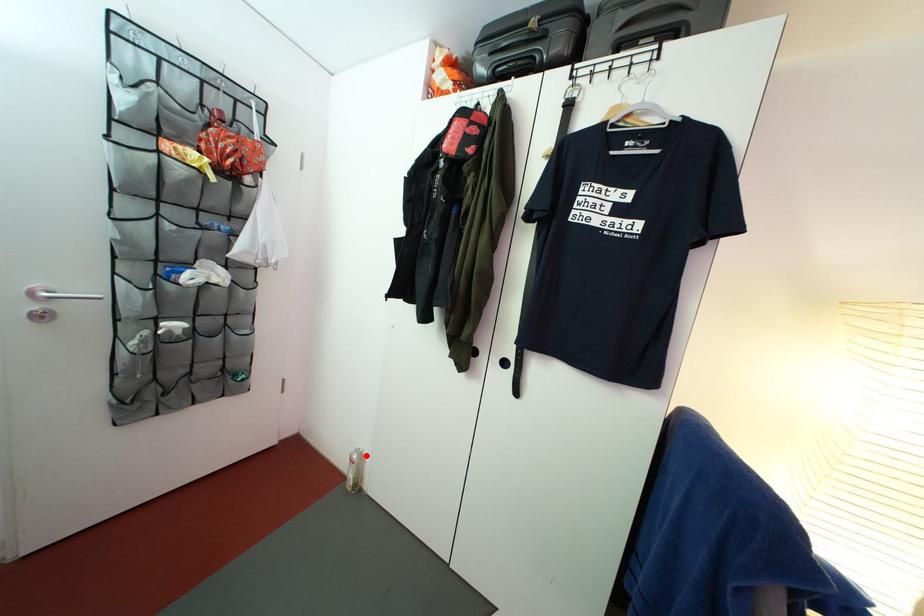
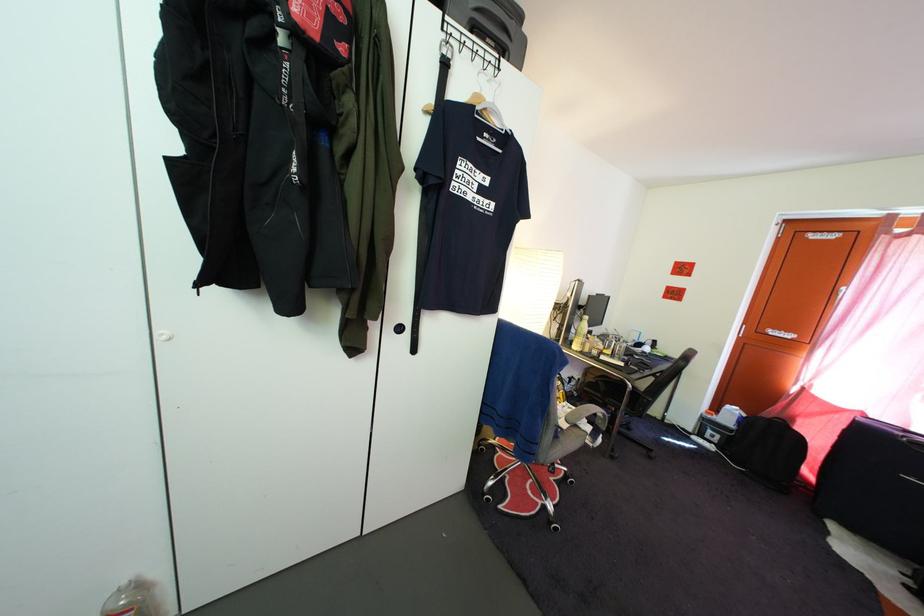
Find the pixel in the second image that matches the highlighted location in the first image.

(132, 591)